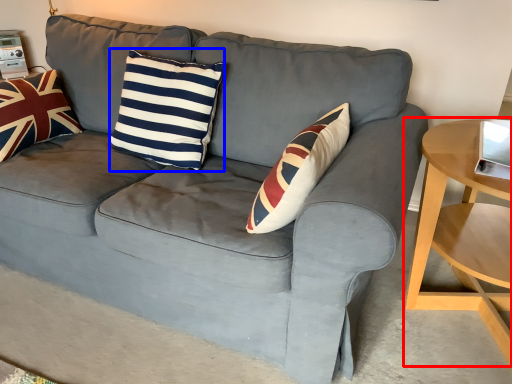
Question: Which object appears farthest to the camera in this image, table (highlighted by a red box) or pillow (highlighted by a blue box)?

Choices:
 (A) table
 (B) pillow

Answer: (B)